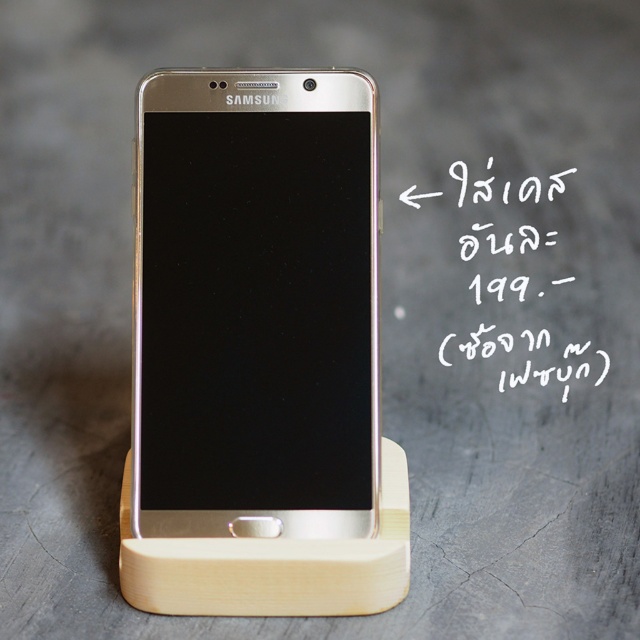
Question: Which of the following is the closest to the observer?

Choices:
 (A) silver metallic smartphone at center
 (B) white handwritten text at upper center

Answer: (A)

Question: Among these points, which one is nearest to the camera?

Choices:
 (A) pos(371,147)
 (B) pos(508,232)

Answer: (A)

Question: Is silver metallic smartphone at center further to camera compared to white handwritten text at upper center?

Choices:
 (A) yes
 (B) no

Answer: (B)

Question: Is silver metallic smartphone at center wider than white handwritten text at upper center?

Choices:
 (A) yes
 (B) no

Answer: (B)

Question: Does silver metallic smartphone at center have a lesser width compared to white handwritten text at upper center?

Choices:
 (A) yes
 (B) no

Answer: (A)